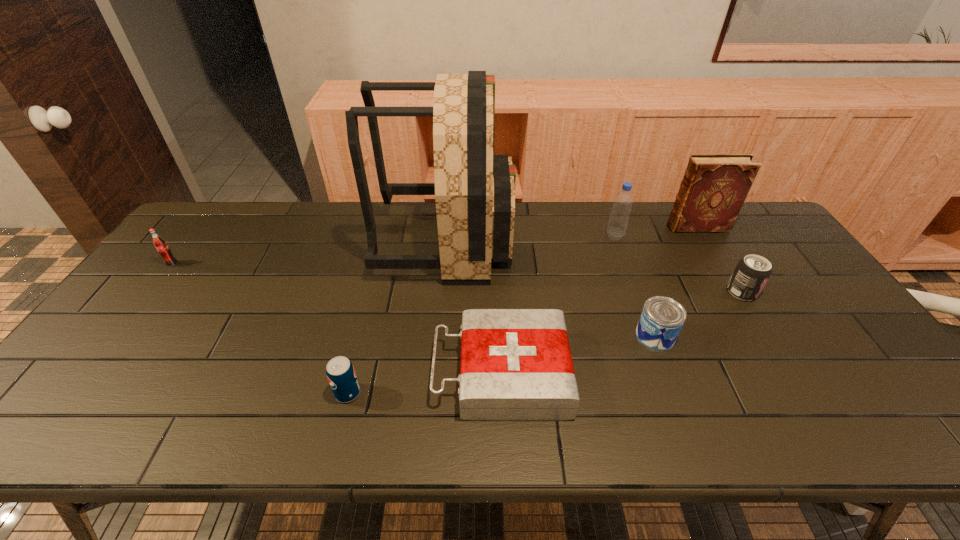
The height and width of the screenshot is (540, 960). I want to click on backpack, so click(474, 189).

Locate an element on the screen. This screenshot has width=960, height=540. the second tallest object is located at coordinates (714, 187).

Where is `the third tallest object`? Image resolution: width=960 pixels, height=540 pixels. the third tallest object is located at coordinates (617, 225).

Where is `the leftmost object`? This screenshot has width=960, height=540. the leftmost object is located at coordinates (159, 243).

Find the location of `the leftmost pop`. the leftmost pop is located at coordinates (159, 243).

At what (x,y) coordinates should I click in order to perform the action: click on the rightmost pop. Please return your answer as a coordinate pair (x, y). This screenshot has width=960, height=540. Looking at the image, I should click on (752, 272).

Locate an element on the screen. Image resolution: width=960 pixels, height=540 pixels. the nearest pop is located at coordinates (341, 375).

At what (x,y) coordinates should I click in order to perform the action: click on can. Please return your answer as a coordinate pair (x, y). The width and height of the screenshot is (960, 540). Looking at the image, I should click on (662, 318).

Image resolution: width=960 pixels, height=540 pixels. Find the location of `the first-aid kit`. the first-aid kit is located at coordinates (516, 365).

The width and height of the screenshot is (960, 540). In order to click on vacant region located on the front face of the tallest object in this screenshot , I will do `click(530, 241)`.